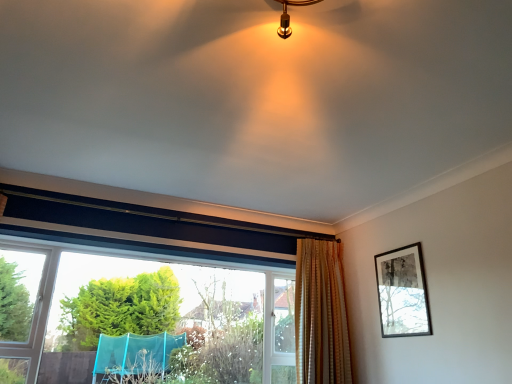
Question: From a real-world perspective, is gold textured curtain at center positioned under black matte picture frame at upper right based on gravity?

Choices:
 (A) yes
 (B) no

Answer: (A)

Question: Is gold textured curtain at center completely or partially outside of black matte picture frame at upper right?

Choices:
 (A) yes
 (B) no

Answer: (A)

Question: Is gold textured curtain at center further to the viewer compared to black matte picture frame at upper right?

Choices:
 (A) no
 (B) yes

Answer: (B)

Question: Would you say gold textured curtain at center is a long distance from black matte picture frame at upper right?

Choices:
 (A) yes
 (B) no

Answer: (B)

Question: From the image's perspective, is gold textured curtain at center over black matte picture frame at upper right?

Choices:
 (A) no
 (B) yes

Answer: (A)

Question: Considering the relative sizes of gold textured curtain at center and black matte picture frame at upper right in the image provided, is gold textured curtain at center bigger than black matte picture frame at upper right?

Choices:
 (A) yes
 (B) no

Answer: (A)

Question: Considering the relative sizes of black matte picture frame at upper right and clear glass window at lower left in the image provided, is black matte picture frame at upper right smaller than clear glass window at lower left?

Choices:
 (A) yes
 (B) no

Answer: (A)

Question: Considering the relative sizes of black matte picture frame at upper right and clear glass window at lower left in the image provided, is black matte picture frame at upper right shorter than clear glass window at lower left?

Choices:
 (A) yes
 (B) no

Answer: (A)

Question: From a real-world perspective, is black matte picture frame at upper right located beneath clear glass window at lower left?

Choices:
 (A) no
 (B) yes

Answer: (A)

Question: Does black matte picture frame at upper right touch clear glass window at lower left?

Choices:
 (A) no
 (B) yes

Answer: (A)

Question: Is black matte picture frame at upper right at the right side of clear glass window at lower left?

Choices:
 (A) no
 (B) yes

Answer: (B)

Question: Is black matte picture frame at upper right far away from clear glass window at lower left?

Choices:
 (A) yes
 (B) no

Answer: (A)

Question: Does gold textured curtain at center have a greater height compared to clear glass window at lower left?

Choices:
 (A) no
 (B) yes

Answer: (B)